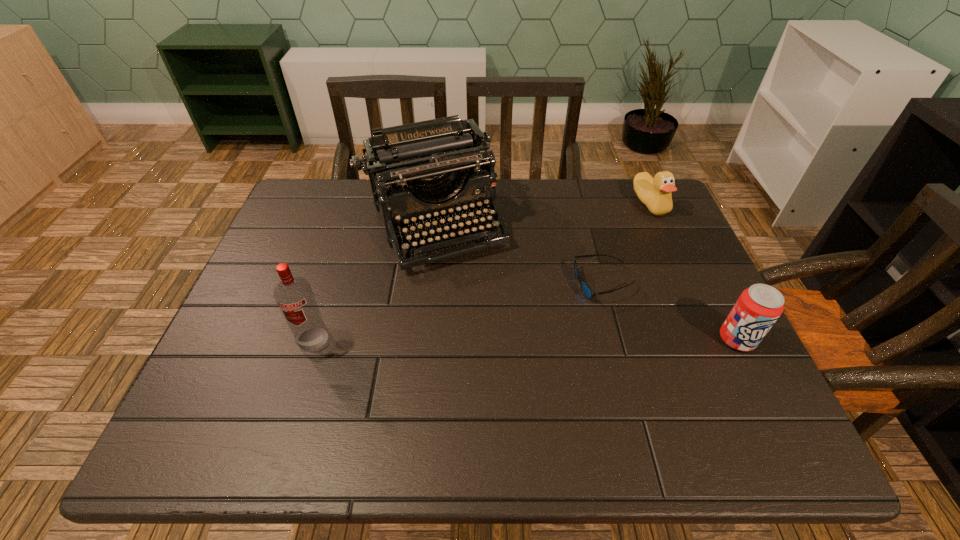
Where is `duck that is positioned at the right edge`? Image resolution: width=960 pixels, height=540 pixels. duck that is positioned at the right edge is located at coordinates (655, 193).

Where is `object present at the far right corner`? This screenshot has height=540, width=960. object present at the far right corner is located at coordinates (655, 193).

The height and width of the screenshot is (540, 960). Identify the location of vacant space at the far edge. (590, 200).

Find the location of `free region at the near edge of the desktop`. free region at the near edge of the desktop is located at coordinates (325, 384).

In the image, there is a desktop. Where is `free space at the right edge`? free space at the right edge is located at coordinates (651, 261).

This screenshot has height=540, width=960. What are the coordinates of `blank space at the far left corner of the desktop` in the screenshot? It's located at (335, 185).

Find the location of a particular element. vacant space that is in between the vodka and the soda can is located at coordinates (525, 339).

This screenshot has height=540, width=960. What are the coordinates of `empty space between the second shortest object and the vodka` in the screenshot? It's located at (481, 272).

Image resolution: width=960 pixels, height=540 pixels. I want to click on free space between the vodka and the third object from left to right, so click(459, 312).

Find the location of a particular element. This screenshot has width=960, height=540. vacant space in between the fourth tallest object and the sunglasses is located at coordinates (627, 244).